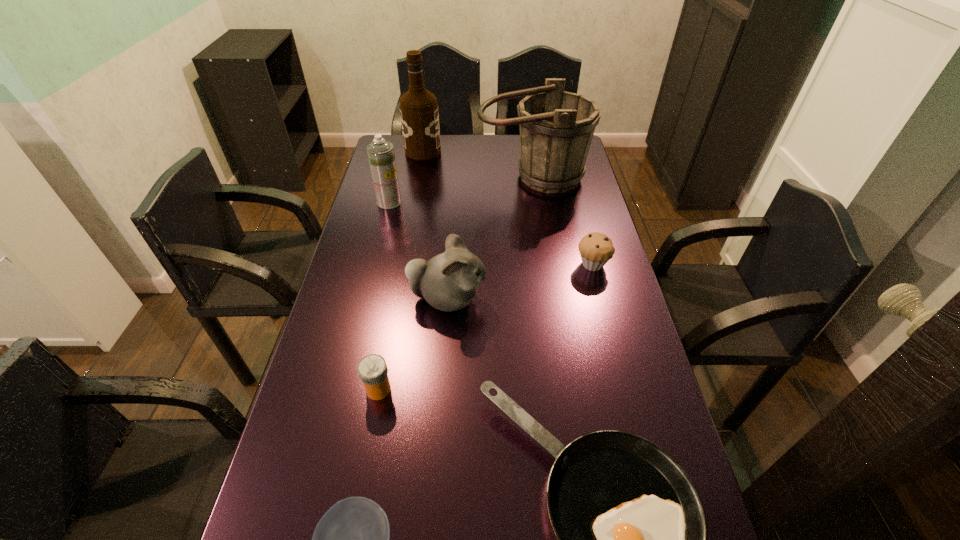
Identify the location of object located at the far left corner. This screenshot has height=540, width=960. (419, 114).

Locate an element on the screen. object at the far right corner is located at coordinates (556, 127).

The image size is (960, 540). I want to click on vacant space at the far edge of the desktop, so click(x=444, y=140).

Identify the location of vacant space at the left edge of the desktop. (358, 341).

Where is `vacant area at the right edge of the desktop`? vacant area at the right edge of the desktop is located at coordinates (566, 245).

Where is `free location at the far left corner of the desktop`? This screenshot has height=540, width=960. free location at the far left corner of the desktop is located at coordinates (389, 136).

This screenshot has width=960, height=540. Find the location of `free space between the tallest object and the medicine`. free space between the tallest object and the medicine is located at coordinates (400, 270).

Locate an element on the screen. The width and height of the screenshot is (960, 540). free space between the aerosol can and the medicine is located at coordinates (384, 296).

Image resolution: width=960 pixels, height=540 pixels. I want to click on free space between the muffin and the medicine, so click(x=486, y=327).

Locate an element on the screen. This screenshot has width=960, height=540. blank region between the tallest object and the fifth farthest object is located at coordinates (436, 225).